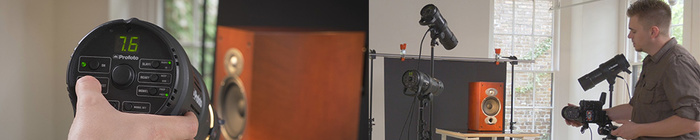
Locate an element on the screen. table is located at coordinates (462, 133).